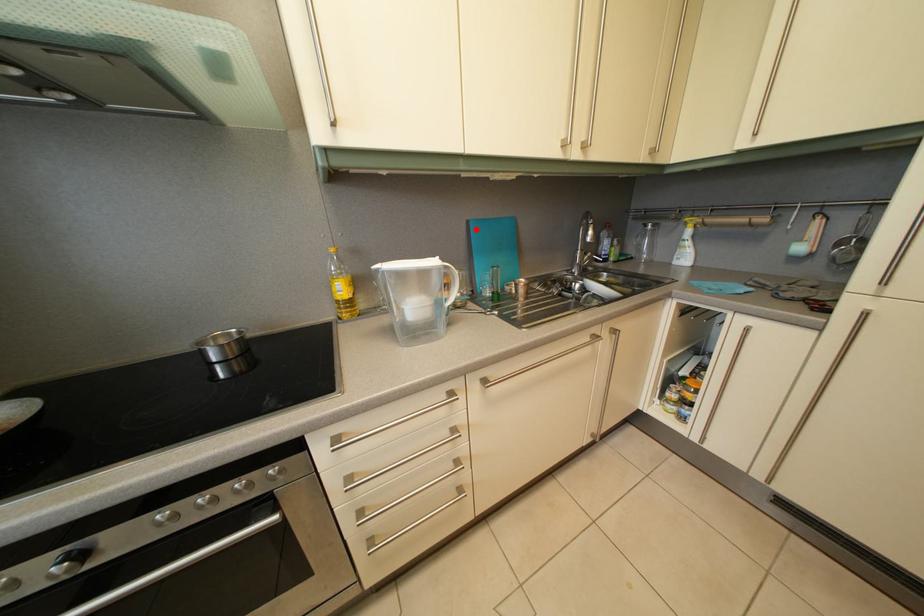
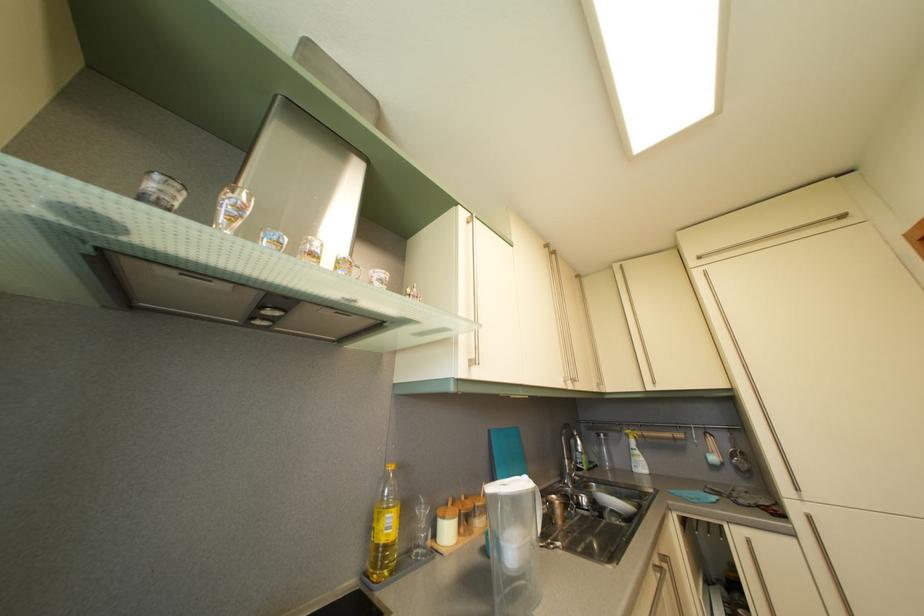
Question: I am providing you with two images of the same scene from different viewpoints. Image1 has a red point marked. In image2, the corresponding 3D location appears at what relative position? Reply with the corresponding letter.

Choices:
 (A) Closer
 (B) Farther

Answer: (B)